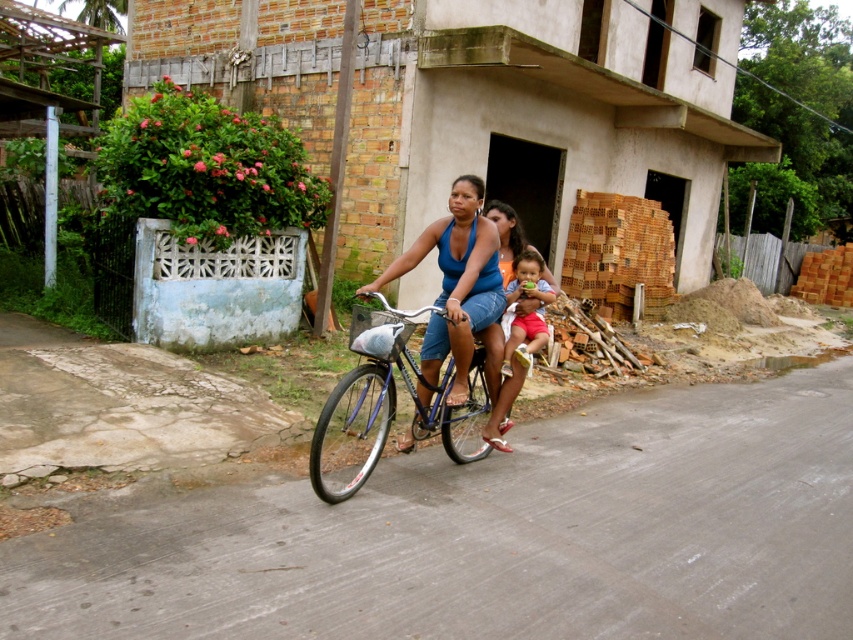
Based on the scene description, can you determine the spatial relationship between the blue fabric tank top at center and the matte red shorts at center?

The blue fabric tank top at center is located above the matte red shorts at center.

You are a photographer trying to capture the woman riding the bicycle with two children. You notice a point at coordinates (x=456, y=282) that corresponds to part of her clothing. Which clothing item is this point located on?

The point at coordinates (x=456, y=282) is located on the blue fabric tank top at center.